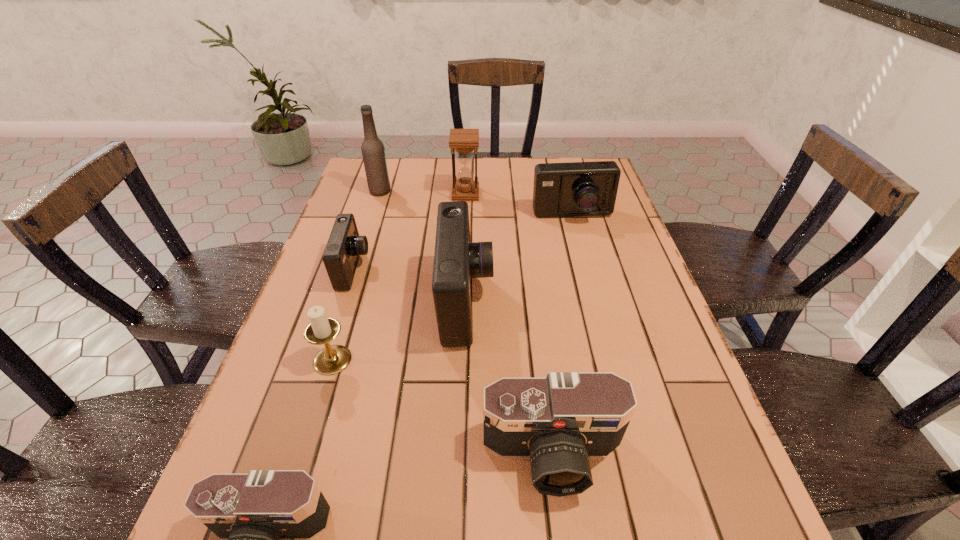
The width and height of the screenshot is (960, 540). Find the location of `object present at the right edge`. object present at the right edge is located at coordinates (570, 189).

Image resolution: width=960 pixels, height=540 pixels. I want to click on object that is at the far left corner, so click(373, 152).

At what (x,y) coordinates should I click in order to perform the action: click on vacant point at the far edge. Please return your answer as a coordinate pair (x, y). Looking at the image, I should click on (508, 169).

Locate an element on the screen. vacant space at the right edge of the desktop is located at coordinates [644, 361].

Locate an element on the screen. The width and height of the screenshot is (960, 540). blank space at the far right corner of the desktop is located at coordinates (568, 161).

Identify the location of unoccupied area between the second blue camera from right to left and the farthest camera. (519, 259).

Find the location of `empty location between the third farthest object and the bigger black camera`. empty location between the third farthest object and the bigger black camera is located at coordinates (563, 336).

Select which object is the closest to the beer bottle. Please provide its 2D coordinates. Your answer should be formatted as a tuple, i.e. [(x, y)], where the tuple contains the x and y coordinates of a point satisfying the conditions above.

[(464, 141)]

This screenshot has width=960, height=540. Identify the location of object that stands as the seventh closest to the smallest blue camera. (266, 519).

The width and height of the screenshot is (960, 540). Identify the location of camera object that ranks as the closest to the bigger black camera. (457, 260).